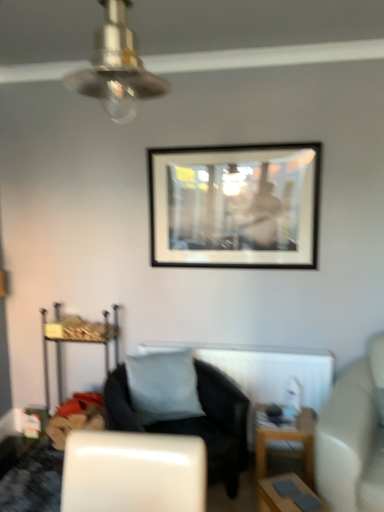
Image resolution: width=384 pixels, height=512 pixels. Find the location of `free location above wooden table at lower right, the second table from the front (from a real-world perspective)`. free location above wooden table at lower right, the second table from the front (from a real-world perspective) is located at coordinates (299, 412).